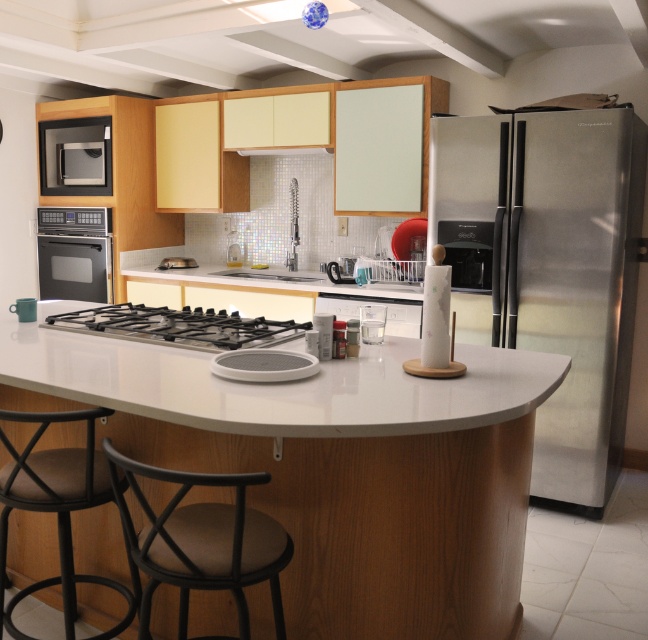
Is black metal bar stool at lower left bigger than satin silver microwave at upper left?

Yes, black metal bar stool at lower left is bigger than satin silver microwave at upper left.

Who is positioned more to the left, black metal bar stool at lower left or satin silver microwave at upper left?

satin silver microwave at upper left

The width and height of the screenshot is (648, 640). I want to click on black metal bar stool at lower left, so click(58, 509).

Is stainless steel refrigerator at right behind satin silver microwave at upper left?

No, stainless steel refrigerator at right is closer to the viewer.

Is stainless steel refrigerator at right closer to camera compared to satin silver microwave at upper left?

Yes, it is.

Who is more distant from viewer, [452,202] or [98,152]?

Positioned behind is point [98,152].

Locate an element on the screen. This screenshot has height=640, width=648. stainless steel refrigerator at right is located at coordinates (553, 268).

Does white glossy countertop at center have a lesser width compared to satin silver microwave at upper left?

In fact, white glossy countertop at center might be wider than satin silver microwave at upper left.

What do you see at coordinates (279, 385) in the screenshot?
I see `white glossy countertop at center` at bounding box center [279, 385].

The width and height of the screenshot is (648, 640). I want to click on white glossy countertop at center, so click(279, 385).